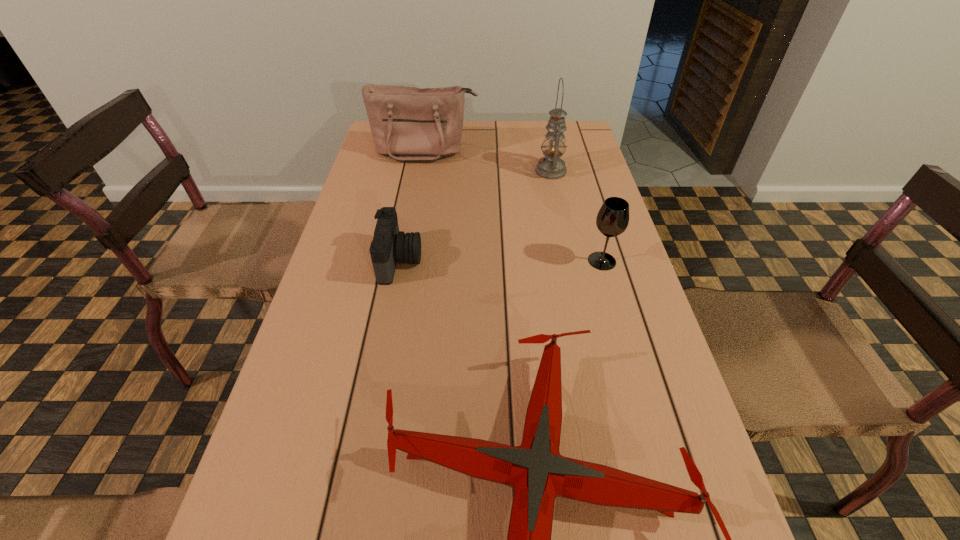
Where is `camera that is at the left edge`? camera that is at the left edge is located at coordinates (389, 246).

Find the location of a particular element. Image resolution: width=960 pixels, height=540 pixels. oil lamp located at the right edge is located at coordinates (551, 166).

The image size is (960, 540). Find the location of `wineglass located in the right edge section of the desktop`. wineglass located in the right edge section of the desktop is located at coordinates (612, 219).

The width and height of the screenshot is (960, 540). Find the location of `object at the far left corner`. object at the far left corner is located at coordinates (407, 123).

Identify the location of vacant region at the far edge of the desktop. (484, 147).

Locate an element on the screen. The width and height of the screenshot is (960, 540). free space at the left edge of the desktop is located at coordinates (370, 246).

The height and width of the screenshot is (540, 960). Identify the location of free space at the right edge of the desktop. (590, 240).

You are a GUI agent. You are given a task and a screenshot of the screen. Output one action in this format:
    pyautogui.click(x=<x>, y=<y>)
    Task: Click on the vacant space in between the oil lamp and the camera
    
    Given the screenshot: What is the action you would take?
    pyautogui.click(x=475, y=216)

Find the location of `free spot between the wineglass and the fourth shortest object`. free spot between the wineglass and the fourth shortest object is located at coordinates (514, 206).

Locate an element on the screen. The width and height of the screenshot is (960, 540). vacant space that's between the shoulder bag and the camera is located at coordinates (413, 206).